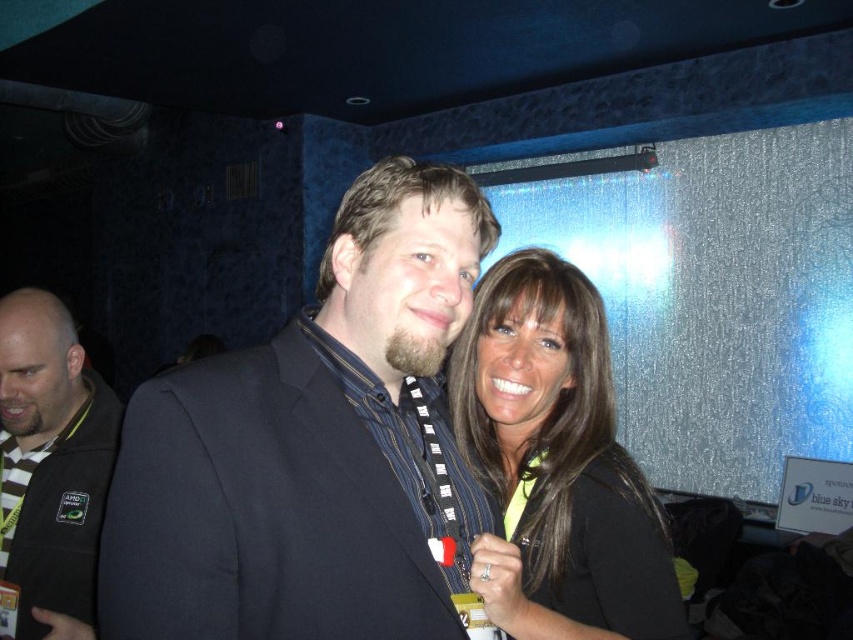
Does point (283, 404) lie behind point (606, 330)?

No, it is not.

Which is in front, point (181, 476) or point (572, 369)?

Point (181, 476) is more forward.

Is point (367, 388) positioned after point (495, 417)?

No, it is in front of (495, 417).

The image size is (853, 640). In order to click on matte black suit at center in this screenshot , I will do [312, 448].

Is matte black shirt at center below dark gray jacket at left?

Incorrect, matte black shirt at center is not positioned below dark gray jacket at left.

Between matte black shirt at center and dark gray jacket at left, which one appears on the right side from the viewer's perspective?

matte black shirt at center is more to the right.

The height and width of the screenshot is (640, 853). In order to click on matte black shirt at center in this screenshot , I will do `click(556, 461)`.

This screenshot has height=640, width=853. What are the coordinates of `matte black shirt at center` in the screenshot? It's located at (556, 461).

Can you confirm if matte black suit at center is positioned below dark gray jacket at left?

No, matte black suit at center is not below dark gray jacket at left.

Find the location of a particular element. matte black suit at center is located at coordinates (312, 448).

Identify the location of matte black suit at center. (312, 448).